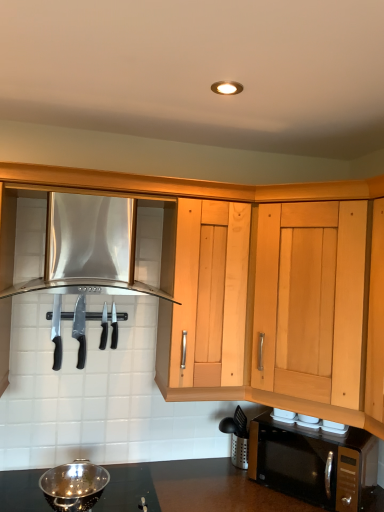
Question: Does stainless steel range hood at upper left, the 2th cabinetry from the right, have a lesser width compared to polished silver knife at center, the second knife viewed from the left?

Choices:
 (A) no
 (B) yes

Answer: (A)

Question: Could you tell me if stainless steel range hood at upper left, the 2th cabinetry from the right, is turned towards polished silver knife at center, the second knife viewed from the left?

Choices:
 (A) yes
 (B) no

Answer: (B)

Question: Is stainless steel range hood at upper left, marked as the first cabinetry in a left-to-right arrangement, further to camera compared to polished silver knife at center, the second knife viewed from the left?

Choices:
 (A) no
 (B) yes

Answer: (A)

Question: Is stainless steel range hood at upper left, marked as the first cabinetry in a left-to-right arrangement, taller than polished silver knife at center, the first knife positioned from the right?

Choices:
 (A) no
 (B) yes

Answer: (B)

Question: Is stainless steel range hood at upper left, marked as the first cabinetry in a left-to-right arrangement, not within polished silver knife at center, the first knife positioned from the right?

Choices:
 (A) yes
 (B) no

Answer: (A)

Question: Considering the relative positions of stainless steel range hood at upper left, the 2th cabinetry from the right, and polished silver knife at center, the first knife positioned from the right, in the image provided, is stainless steel range hood at upper left, the 2th cabinetry from the right, to the right of polished silver knife at center, the first knife positioned from the right, from the viewer's perspective?

Choices:
 (A) no
 (B) yes

Answer: (B)

Question: Considering the relative sizes of polished stainless steel bowl at lower left and black plastic knife at center, the first silverware viewed from the left, in the image provided, is polished stainless steel bowl at lower left thinner than black plastic knife at center, the first silverware viewed from the left,?

Choices:
 (A) yes
 (B) no

Answer: (B)

Question: Does polished stainless steel bowl at lower left have a greater height compared to black plastic knife at center, arranged as the second silverware when viewed from the right?

Choices:
 (A) no
 (B) yes

Answer: (A)

Question: Is polished stainless steel bowl at lower left shorter than black plastic knife at center, the first silverware viewed from the left?

Choices:
 (A) no
 (B) yes

Answer: (B)

Question: Is polished stainless steel bowl at lower left to the right of black plastic knife at center, arranged as the second silverware when viewed from the right, from the viewer's perspective?

Choices:
 (A) yes
 (B) no

Answer: (B)

Question: Is polished stainless steel bowl at lower left positioned in front of black plastic knife at center, arranged as the second silverware when viewed from the right?

Choices:
 (A) no
 (B) yes

Answer: (B)

Question: From the image's perspective, would you say polished stainless steel bowl at lower left is positioned over black plastic knife at center, arranged as the second silverware when viewed from the right?

Choices:
 (A) no
 (B) yes

Answer: (A)

Question: From the image's perspective, does black matte microwave at lower right appear lower than stainless steel range hood at upper left, marked as the first cabinetry in a left-to-right arrangement?

Choices:
 (A) yes
 (B) no

Answer: (A)